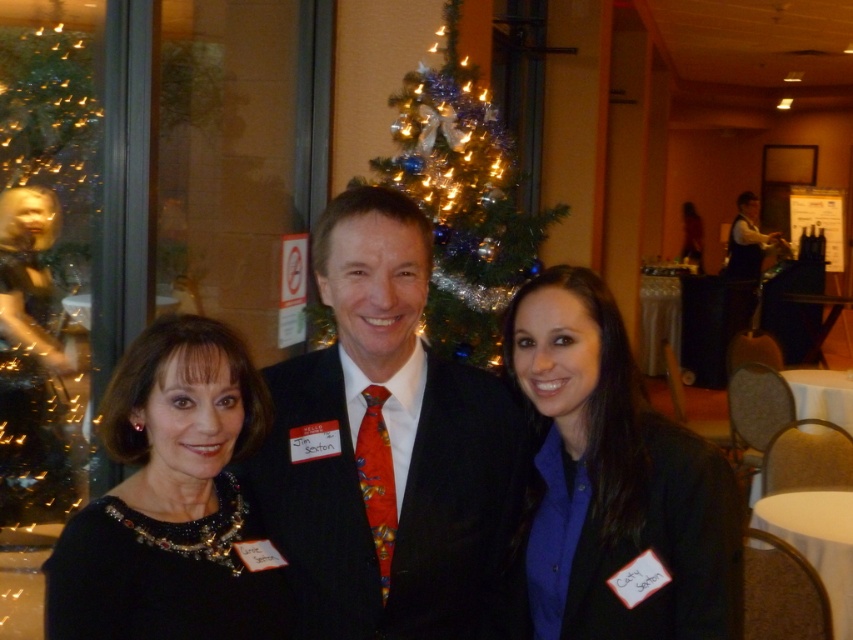
Is shiny gold statue at left to the left of white plastic table at center from the viewer's perspective?

Correct, you'll find shiny gold statue at left to the left of white plastic table at center.

Is shiny gold statue at left wider than white plastic table at center?

Incorrect, shiny gold statue at left's width does not surpass white plastic table at center's.

Is point (39, 388) closer to viewer compared to point (848, 298)?

Yes.

The image size is (853, 640). I want to click on shiny gold statue at left, so click(32, 365).

Is matte black dress at center shorter than dark suit at center?

Indeed, matte black dress at center has a lesser height compared to dark suit at center.

This screenshot has width=853, height=640. What are the coordinates of `matte black dress at center` in the screenshot? It's located at (477, 483).

Between black matte jacket at center and iridescent glass christmas tree at center, which one has less height?

black matte jacket at center is shorter.

Can you confirm if black matte jacket at center is bigger than iridescent glass christmas tree at center?

Incorrect, black matte jacket at center is not larger than iridescent glass christmas tree at center.

Is point (686, 477) in front of point (479, 106)?

Yes, it is in front of point (479, 106).

Find the location of a particular element. The image size is (853, 640). black matte jacket at center is located at coordinates (613, 481).